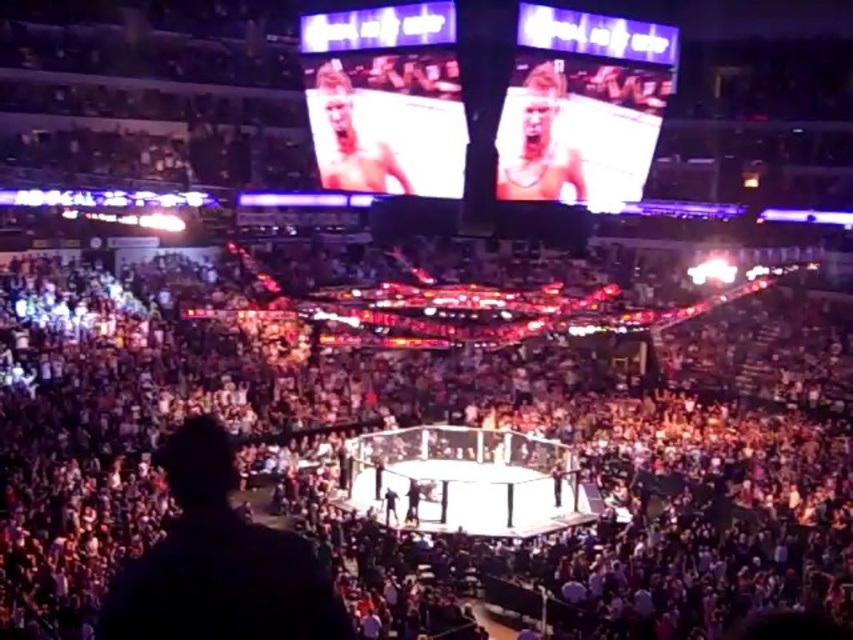
From the picture: In the image of the MMA event, there is a point labeled as point (537, 140). Which object from the scene is positioned exactly at this coordinate?

The smooth skin face at upper right is located at point (537, 140).